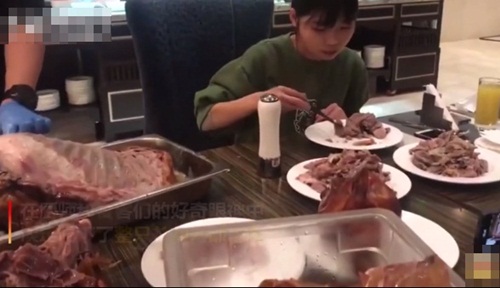
Find the location of a particular element. Image resolution: width=500 pixels, height=288 pixels. salt shaker is located at coordinates (272, 135).